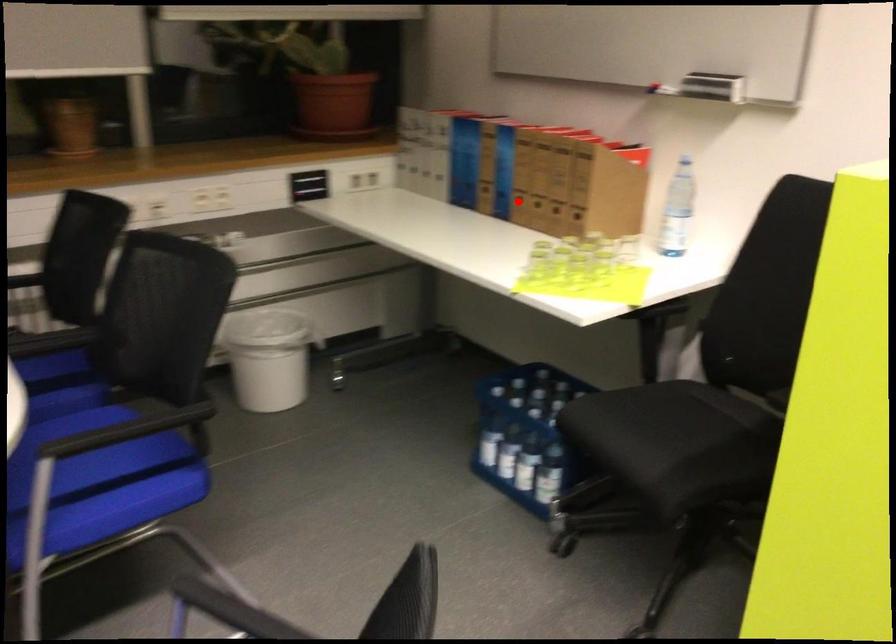
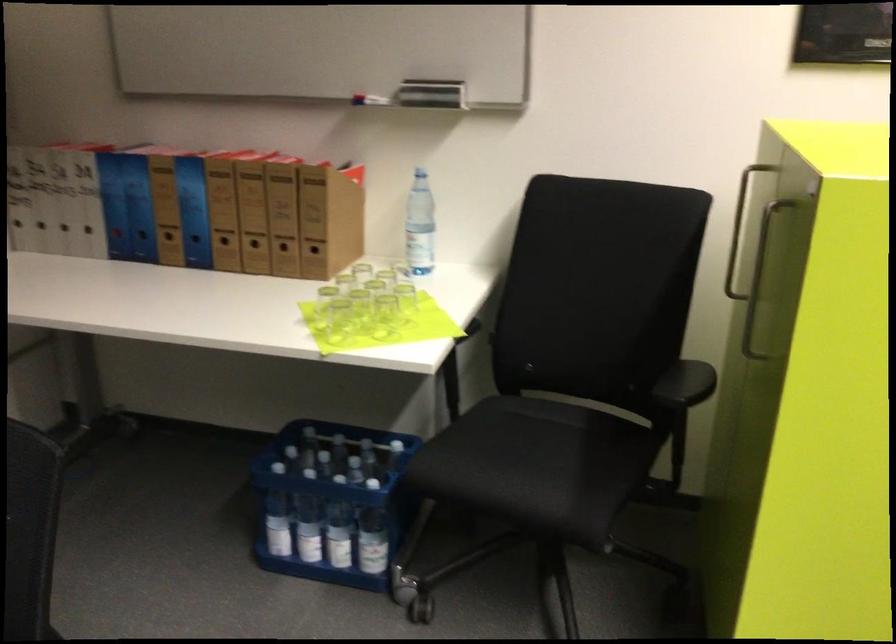
The point at the highlighted location is marked in the first image. Where is the corresponding point in the second image?

(225, 245)